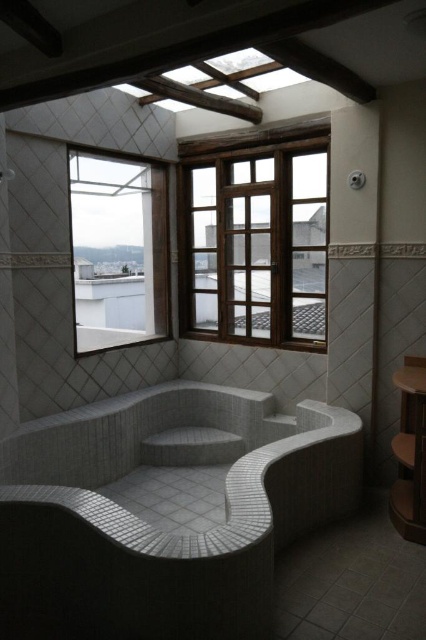
Question: Can you confirm if white mosaic tile jacuzzi at lower center is positioned below wooden-framed window at center?

Choices:
 (A) no
 (B) yes

Answer: (B)

Question: Which of the following is the farthest from the observer?

Choices:
 (A) (273, 292)
 (B) (100, 260)

Answer: (B)

Question: Which of the following is the farthest from the observer?

Choices:
 (A) wooden-framed window at center
 (B) white mosaic tile jacuzzi at lower center

Answer: (A)

Question: Observing the image, what is the correct spatial positioning of white mosaic tile jacuzzi at lower center in reference to wooden-framed window at center?

Choices:
 (A) below
 (B) above

Answer: (A)

Question: Which object is the closest to the wooden-framed window at center?

Choices:
 (A) white mosaic tile jacuzzi at lower center
 (B) clear glass window at upper left

Answer: (A)

Question: In this image, where is white mosaic tile jacuzzi at lower center located relative to wooden-framed window at center?

Choices:
 (A) right
 (B) left

Answer: (B)